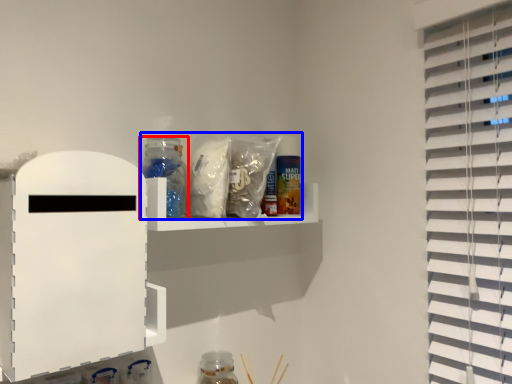
Question: Among these objects, which one is farthest to the camera, bottle (highlighted by a red box) or food (highlighted by a blue box)?

Choices:
 (A) bottle
 (B) food

Answer: (A)